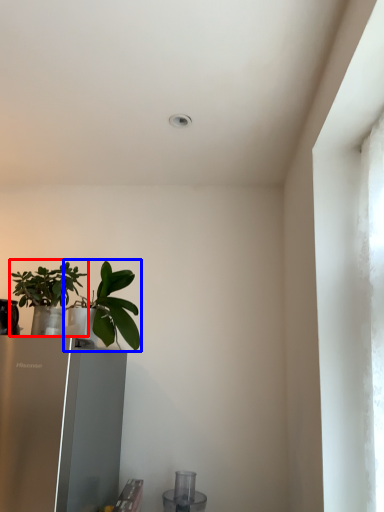
Question: Which of the following is the farthest to the observer, houseplant (highlighted by a red box) or houseplant (highlighted by a blue box)?

Choices:
 (A) houseplant
 (B) houseplant

Answer: (B)